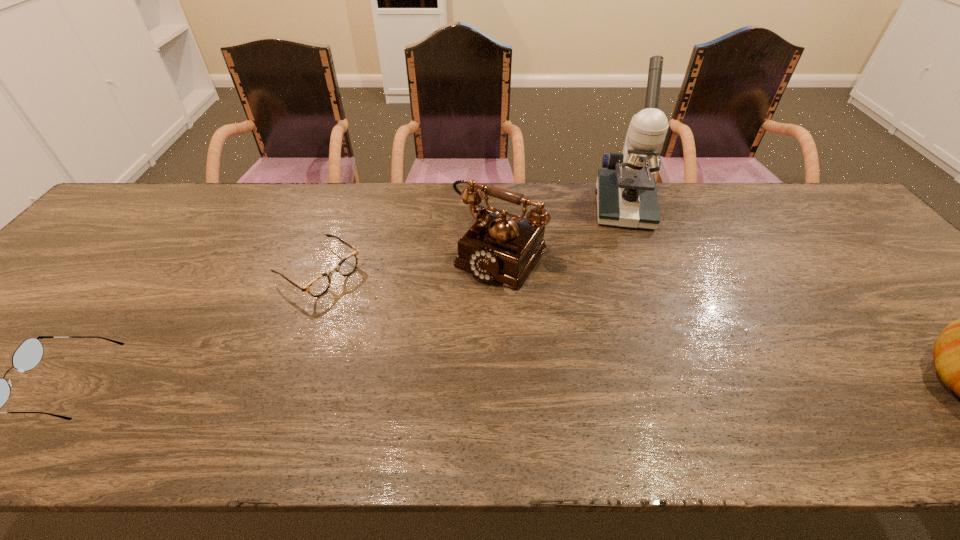
In order to click on vacant space on the desktop that is between the left spectacles and the gourd and is positioned on the frame of the farther spectacles in this screenshot , I will do `click(492, 384)`.

Where is `free space on the desktop that is between the leftmost object and the rightmost object and is positioned on the dial of the telephone`? This screenshot has height=540, width=960. free space on the desktop that is between the leftmost object and the rightmost object and is positioned on the dial of the telephone is located at coordinates (397, 384).

Locate an element on the screen. The height and width of the screenshot is (540, 960). vacant spot on the desktop that is between the leftmost object and the third tallest object and is positioned at the eyepiece of the second object from right to left is located at coordinates (645, 384).